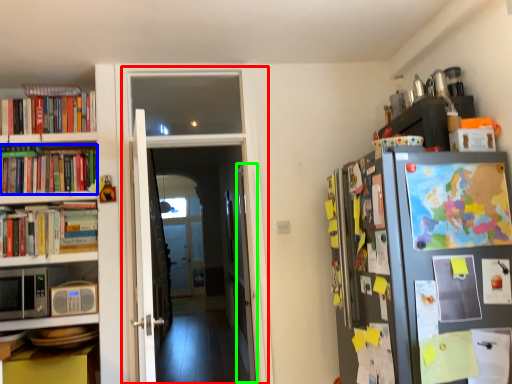
Question: Which object is the farthest from corridor (highlighted by a red box)? Choose among these: book (highlighted by a blue box) or door (highlighted by a green box).

Choices:
 (A) book
 (B) door

Answer: (A)